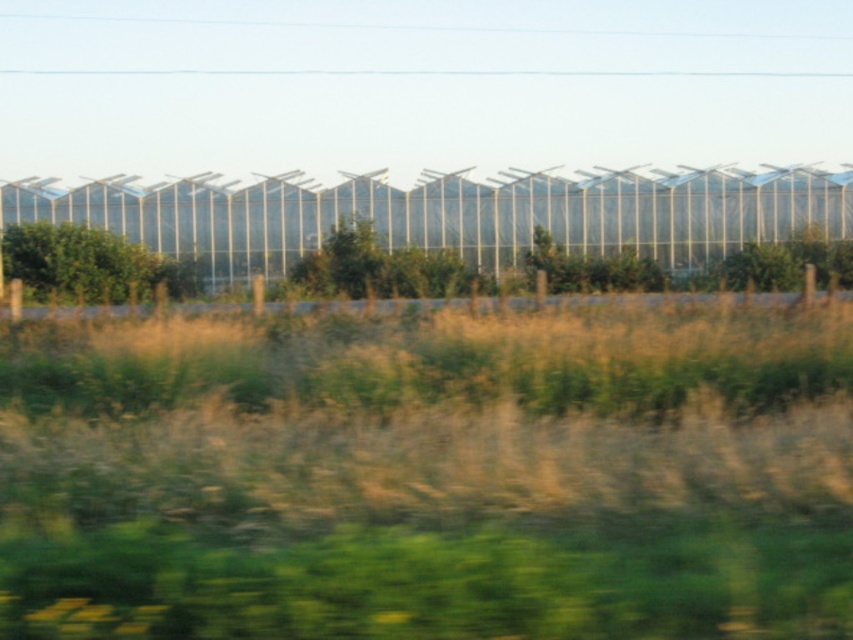
You are a landscape architect planning to install a new walkway between the green grass at center and the green leafy tree at left. The walkway must be exactly 25 meters long. Will the walkway fit perfectly between them?

The distance between the green grass at center and the green leafy tree at left is 25.39 meters, so a 25 meter walkway would be slightly shorter than the required distance. Therefore, it won

You are standing in a rural area and see the green grass at center and the green leafy tree at left. Which one is nearer to you?

The green grass at center is closer to the viewer than the green leafy tree at left.